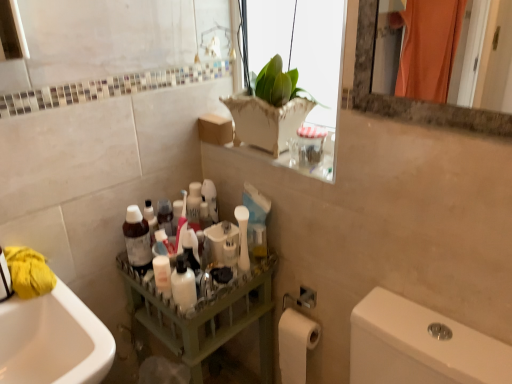
Question: Does matte green tray at center have a larger size compared to white glossy bottle at center?

Choices:
 (A) no
 (B) yes

Answer: (B)

Question: Can you confirm if matte green tray at center is smaller than white glossy bottle at center?

Choices:
 (A) yes
 (B) no

Answer: (B)

Question: From a real-world perspective, is matte green tray at center positioned over white glossy bottle at center based on gravity?

Choices:
 (A) no
 (B) yes

Answer: (A)

Question: Can you confirm if matte green tray at center is shorter than white glossy bottle at center?

Choices:
 (A) no
 (B) yes

Answer: (A)

Question: From the image's perspective, would you say matte green tray at center is shown under white glossy bottle at center?

Choices:
 (A) no
 (B) yes

Answer: (B)

Question: From the image's perspective, would you say matte green tray at center is positioned over white glossy bottle at center?

Choices:
 (A) no
 (B) yes

Answer: (A)

Question: Is matte green tray at center further to the viewer compared to white matte toilet paper at lower right?

Choices:
 (A) no
 (B) yes

Answer: (A)

Question: From a real-world perspective, does matte green tray at center stand above white matte toilet paper at lower right?

Choices:
 (A) no
 (B) yes

Answer: (A)

Question: Can you confirm if matte green tray at center is wider than white matte toilet paper at lower right?

Choices:
 (A) yes
 (B) no

Answer: (A)

Question: Is matte green tray at center thinner than white matte toilet paper at lower right?

Choices:
 (A) yes
 (B) no

Answer: (B)

Question: Is matte green tray at center smaller than white matte toilet paper at lower right?

Choices:
 (A) no
 (B) yes

Answer: (A)

Question: Is matte green tray at center facing towards white matte toilet paper at lower right?

Choices:
 (A) no
 (B) yes

Answer: (A)

Question: From the image's perspective, is matte plastic bottle at center on top of white glossy bottle at center?

Choices:
 (A) no
 (B) yes

Answer: (B)